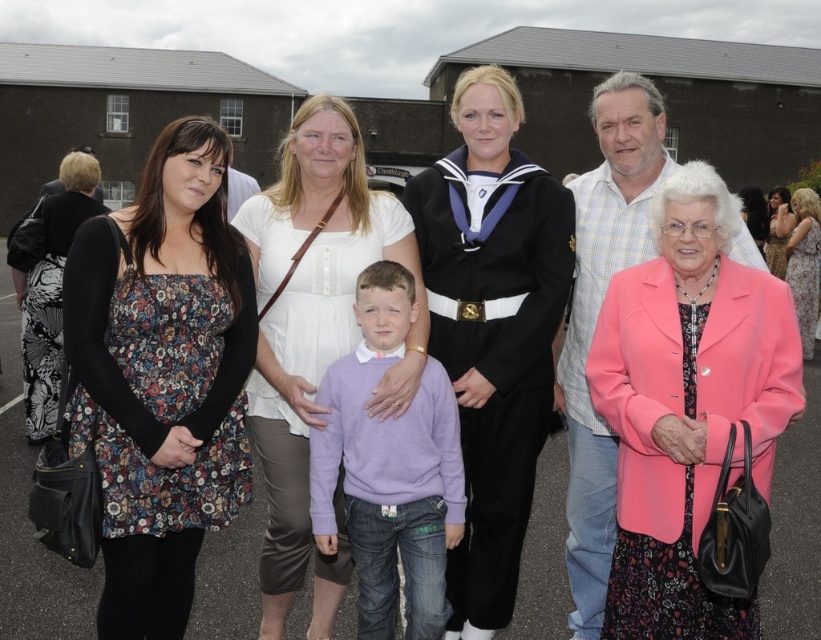
Question: Which of the following is the closest to the observer?

Choices:
 (A) black and white floral dress at left
 (B) floral dress at right
 (C) white cotton shirt at center
 (D) pink fabric coat at center

Answer: (C)

Question: Which point is closer to the camera?

Choices:
 (A) sailor uniform at center
 (B) floral-patterned dress at left
 (C) printed fabric dress at upper right
 (D) pink fabric coat at center

Answer: (B)

Question: Which point is closer to the camera?

Choices:
 (A) (792, 292)
 (B) (30, 440)

Answer: (B)

Question: Is white cotton shirt at center positioned in front of lavender sweater at center?

Choices:
 (A) no
 (B) yes

Answer: (A)

Question: Observing the image, what is the correct spatial positioning of pink fabric coat at center in reference to black and white floral dress at left?

Choices:
 (A) below
 (B) above

Answer: (A)

Question: Can you confirm if sailor uniform at center is positioned to the left of lavender sweater at center?

Choices:
 (A) yes
 (B) no

Answer: (B)